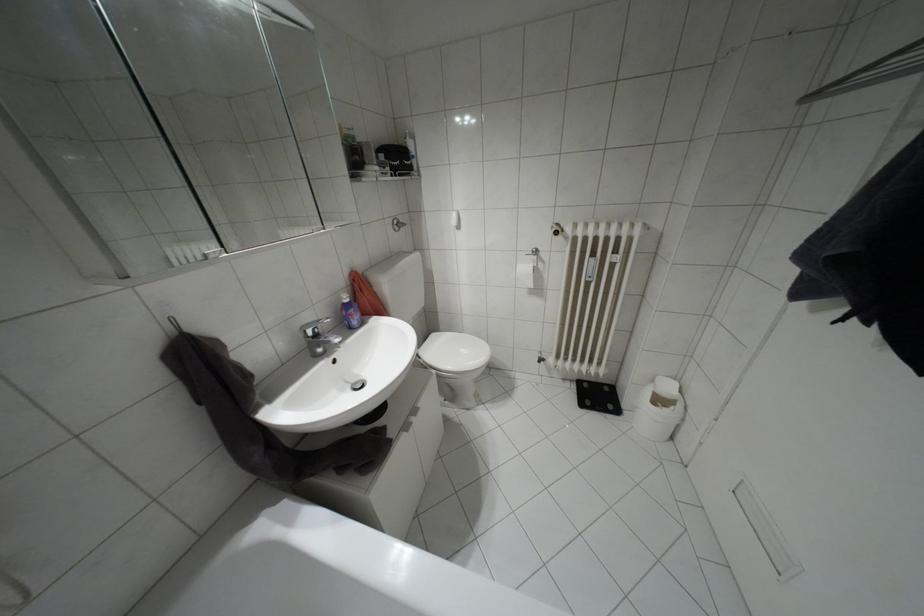
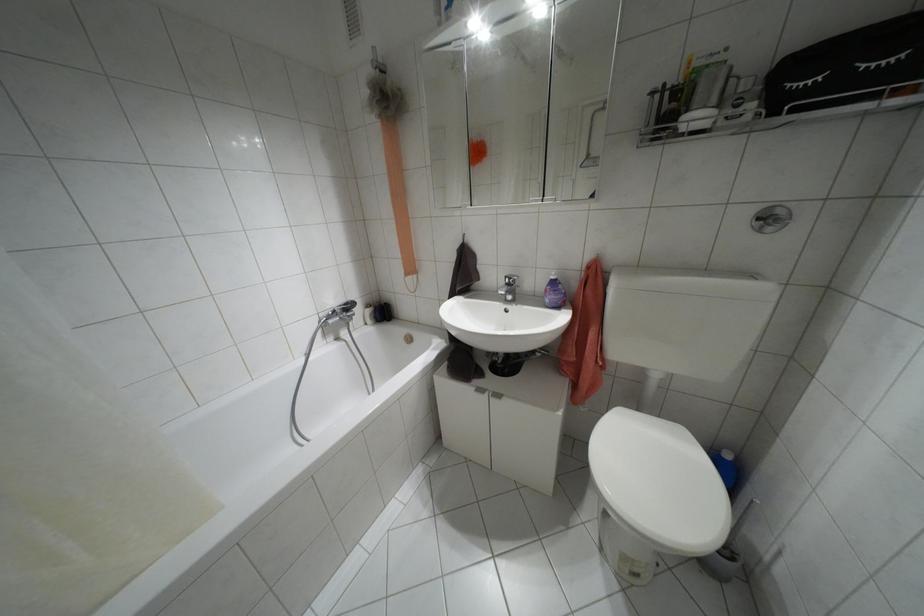
Find the pixel in the second image that matches (346,300) in the first image.

(552, 277)